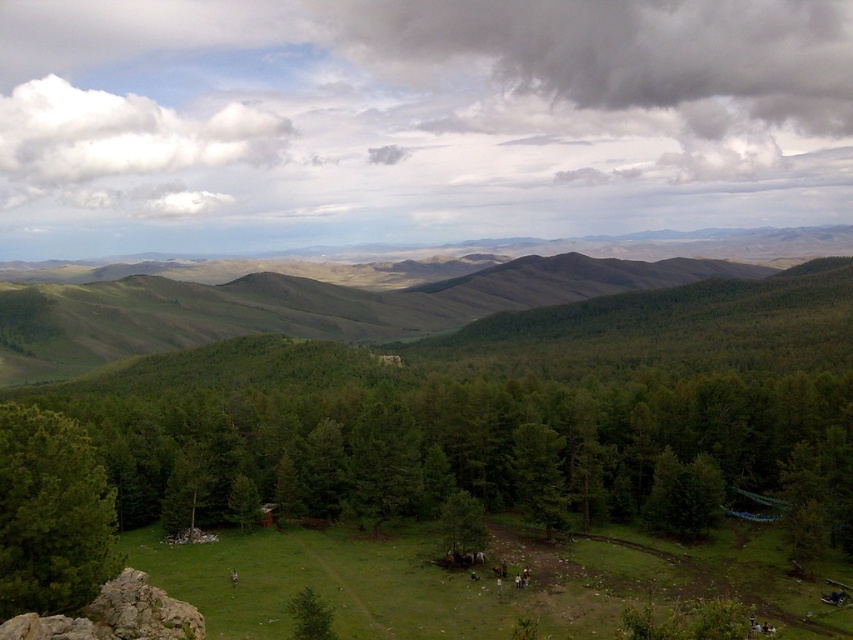
Who is lower down, green matte forest at center or green matte tree at lower left?

green matte forest at center is lower down.

Who is more distant from viewer, (186,408) or (57,451)?

The point (186,408) is more distant.

Identify the location of green matte forest at center. (479, 440).

Who is more forward, (x=422, y=392) or (x=732, y=97)?

Point (x=422, y=392) is in front.

Is green matte forest at center wider than dark gray cloud at upper center?

In fact, green matte forest at center might be narrower than dark gray cloud at upper center.

Find the location of a particular element. This screenshot has width=853, height=640. green matte forest at center is located at coordinates (479, 440).

Where is `green matte forest at center`? green matte forest at center is located at coordinates (479, 440).

Which is behind, point (485, 470) or point (585, 541)?

Point (485, 470)

Can you confirm if green matte forest at center is thinner than green grassy field at lower center?

Incorrect, green matte forest at center's width is not less than green grassy field at lower center's.

This screenshot has height=640, width=853. In order to click on green matte forest at center in this screenshot , I will do `click(479, 440)`.